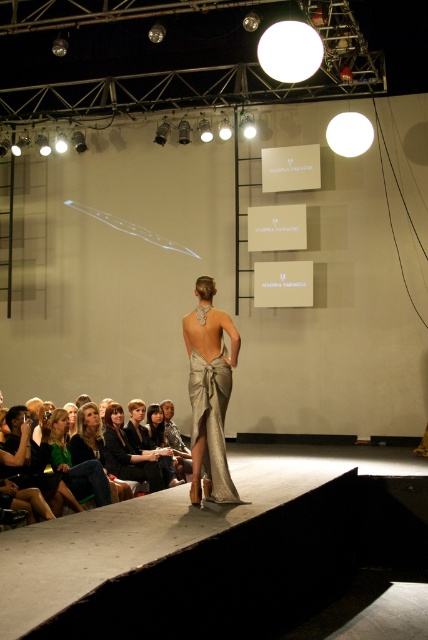
Can you confirm if green fabric dress at lower left is thinner than matte silver dress at center?

Incorrect, green fabric dress at lower left's width is not less than matte silver dress at center's.

Is green fabric dress at lower left to the right of matte silver dress at center from the viewer's perspective?

In fact, green fabric dress at lower left is to the left of matte silver dress at center.

Between point (88, 477) and point (80, 458), which one is positioned in front?

Point (88, 477) is more forward.

At what (x,y) coordinates should I click in order to perform the action: click on green fabric dress at lower left. Please return your answer as a coordinate pair (x, y). This screenshot has width=428, height=640. Looking at the image, I should click on (76, 465).

Does green fabric dress at lower left appear on the right side of matte black dress at center?

In fact, green fabric dress at lower left is to the left of matte black dress at center.

Which is more to the left, green fabric dress at lower left or matte black dress at center?

green fabric dress at lower left

Is point (98, 460) behind point (154, 476)?

No, (98, 460) is closer to viewer.

Image resolution: width=428 pixels, height=640 pixels. What are the coordinates of `green fabric dress at lower left` in the screenshot? It's located at (76, 465).

Does satin metallic dress at center have a greater width compared to matte silver dress at center?

No.

Is point (196, 464) in front of point (98, 428)?

Yes.

I want to click on satin metallic dress at center, so click(210, 392).